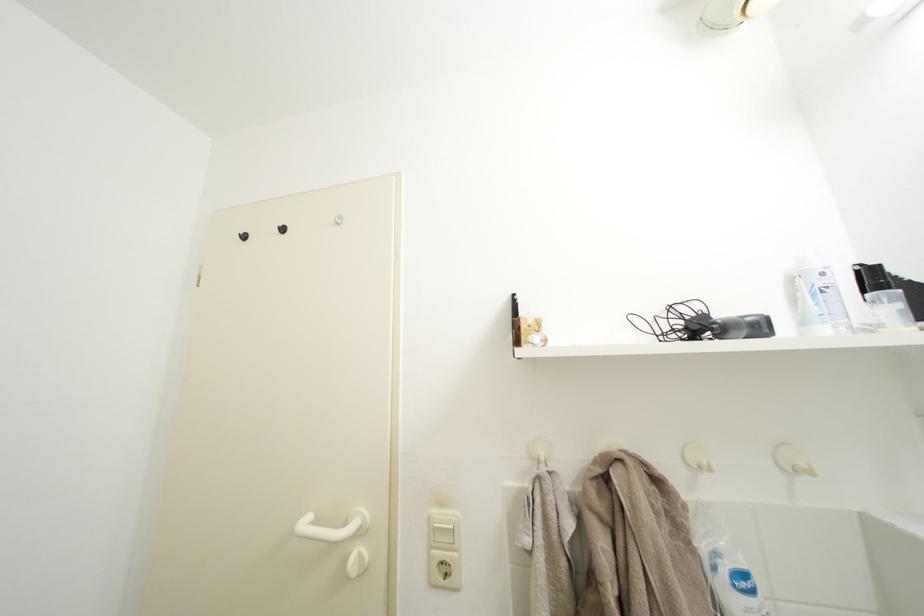
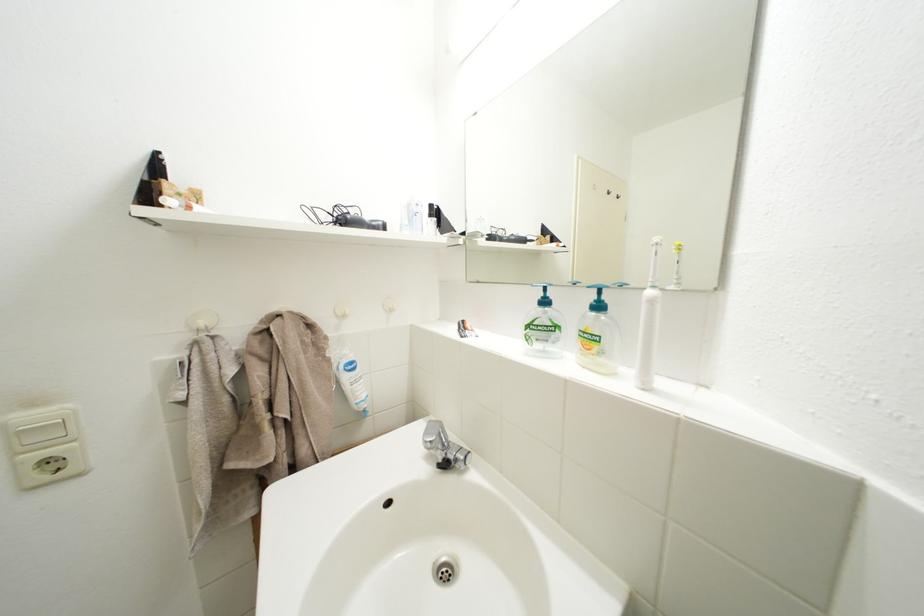
Find the pixel in the second image that matches (552,460) in the first image.

(211, 329)